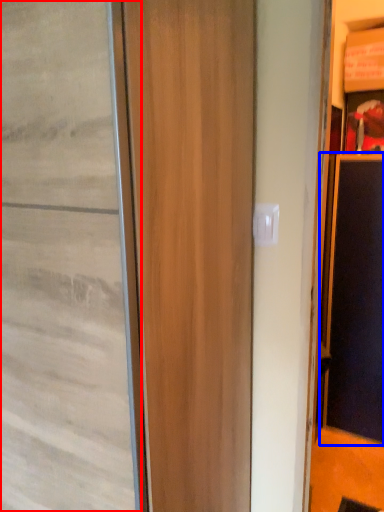
Question: Which object appears farthest to the camera in this image, door (highlighted by a red box) or screen door (highlighted by a blue box)?

Choices:
 (A) door
 (B) screen door

Answer: (B)